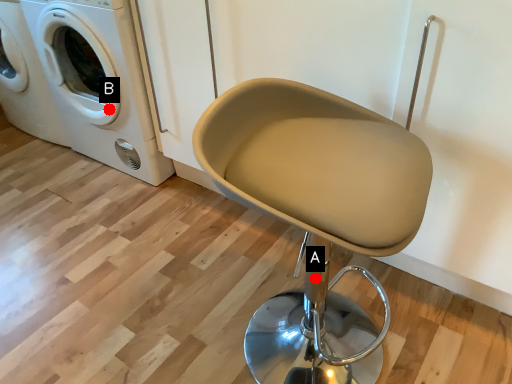
Question: Two points are circled on the image, labeled by A and B beside each circle. Among these points, which one is nearest to the camera?

Choices:
 (A) A is closer
 (B) B is closer

Answer: (A)